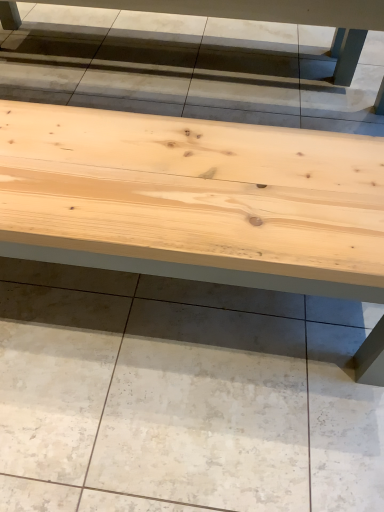
The width and height of the screenshot is (384, 512). I want to click on natural wood table at center, so click(193, 199).

What do you see at coordinates (193, 199) in the screenshot?
I see `natural wood table at center` at bounding box center [193, 199].

You are a GUI agent. You are given a task and a screenshot of the screen. Output one action in this format:
    pyautogui.click(x=<x>, y=<y>)
    Task: Click on the natural wood table at center
    The image size is (384, 512).
    Given the screenshot: What is the action you would take?
    pyautogui.click(x=193, y=199)